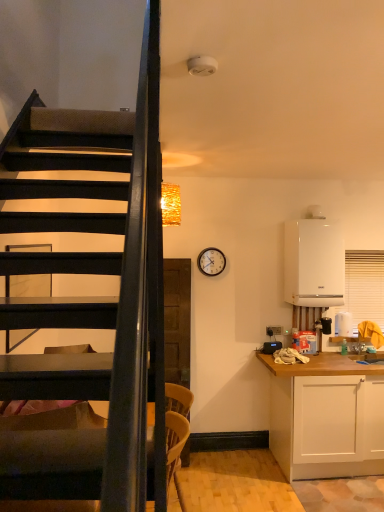
Question: Can you confirm if white glossy boiler at right is taller than white matte cabinet at lower right?

Choices:
 (A) yes
 (B) no

Answer: (B)

Question: Is white matte cabinet at lower right surrounded by white glossy boiler at right?

Choices:
 (A) yes
 (B) no

Answer: (B)

Question: Does white glossy boiler at right have a greater width compared to white matte cabinet at lower right?

Choices:
 (A) yes
 (B) no

Answer: (B)

Question: Is white glossy boiler at right closer to camera compared to white matte cabinet at lower right?

Choices:
 (A) no
 (B) yes

Answer: (A)

Question: Considering the relative sizes of white glossy boiler at right and white matte cabinet at lower right in the image provided, is white glossy boiler at right thinner than white matte cabinet at lower right?

Choices:
 (A) yes
 (B) no

Answer: (A)

Question: Is white glossy boiler at right facing towards white matte cabinet at lower right?

Choices:
 (A) yes
 (B) no

Answer: (B)

Question: From a real-world perspective, is white matte cabinet at lower right physically above light brown woven chair at lower center?

Choices:
 (A) no
 (B) yes

Answer: (A)

Question: From a real-world perspective, is white matte cabinet at lower right below light brown woven chair at lower center?

Choices:
 (A) yes
 (B) no

Answer: (A)

Question: Considering the relative sizes of white matte cabinet at lower right and light brown woven chair at lower center in the image provided, is white matte cabinet at lower right wider than light brown woven chair at lower center?

Choices:
 (A) no
 (B) yes

Answer: (B)

Question: Considering the relative positions of white matte cabinet at lower right and light brown woven chair at lower center in the image provided, is white matte cabinet at lower right to the left of light brown woven chair at lower center from the viewer's perspective?

Choices:
 (A) yes
 (B) no

Answer: (B)

Question: Is white matte cabinet at lower right facing towards light brown woven chair at lower center?

Choices:
 (A) yes
 (B) no

Answer: (B)

Question: Does white matte cabinet at lower right lie behind light brown woven chair at lower center?

Choices:
 (A) yes
 (B) no

Answer: (A)

Question: Is light brown woven chair at lower center taller than white matte cabinet at lower right?

Choices:
 (A) no
 (B) yes

Answer: (A)